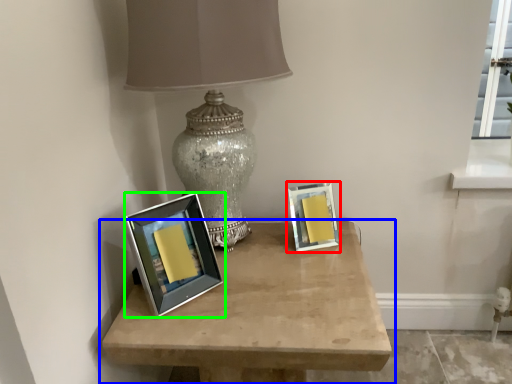
Question: Estimate the real-world distances between objects in this image. Which object is farther from picture frame (highlighted by a red box), table (highlighted by a blue box) or picture frame (highlighted by a green box)?

Choices:
 (A) table
 (B) picture frame

Answer: (B)